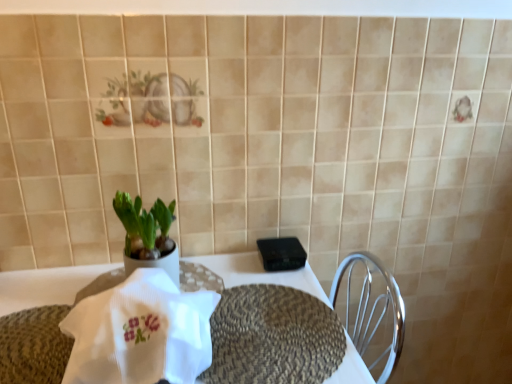
Question: In terms of height, does green matte plant at center look taller or shorter compared to white woven placemat at center?

Choices:
 (A) short
 (B) tall

Answer: (A)

Question: From a real-world perspective, is green matte plant at center positioned above or below white woven placemat at center?

Choices:
 (A) above
 (B) below

Answer: (A)

Question: Based on their relative distances, which object is farther from the white woven placemat at center?

Choices:
 (A) braided woven placemat at center
 (B) green matte plant at center
 (C) black plastic device at center
 (D) white ribbed cloth at center

Answer: (D)

Question: Considering the real-world distances, which object is closest to the black plastic device at center?

Choices:
 (A) white woven placemat at center
 (B) white ribbed cloth at center
 (C) braided woven placemat at center
 (D) green matte plant at center

Answer: (A)